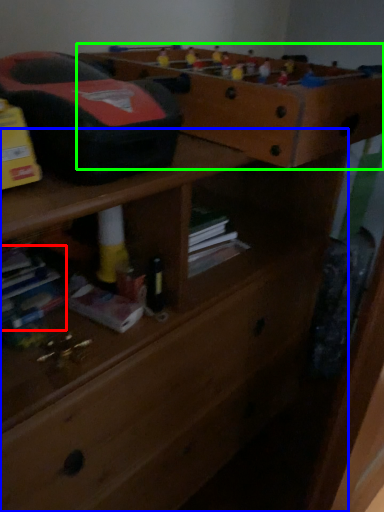
Question: Considering the real-world distances, which object is closest to book (highlighted by a red box)? chest of drawers (highlighted by a blue box) or shelf (highlighted by a green box).

Choices:
 (A) chest of drawers
 (B) shelf

Answer: (A)